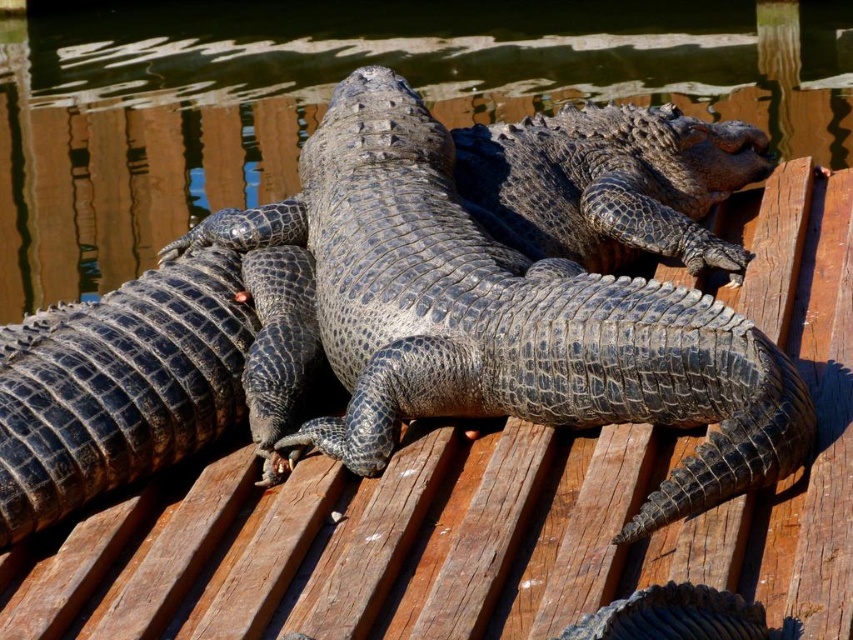
Is glossy black crocodile at center to the right of leathery dark gray crocodile at center from the viewer's perspective?

In fact, glossy black crocodile at center is to the left of leathery dark gray crocodile at center.

Identify the location of glossy black crocodile at center. The height and width of the screenshot is (640, 853). (328, 93).

At what (x,y) coordinates should I click in order to perform the action: click on glossy black crocodile at center. Please return your answer as a coordinate pair (x, y). This screenshot has width=853, height=640. Looking at the image, I should click on (328, 93).